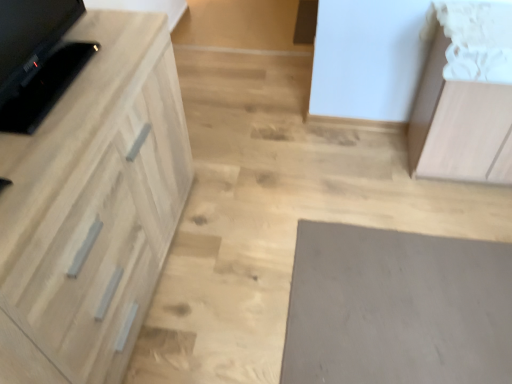
You are a GUI agent. You are given a task and a screenshot of the screen. Output one action in this format:
    pyautogui.click(x=<x>, y=<y>)
    Task: Click on the free space below black glossy tv at left (from a real-world perspective)
    
    Given the screenshot: What is the action you would take?
    pyautogui.click(x=46, y=81)